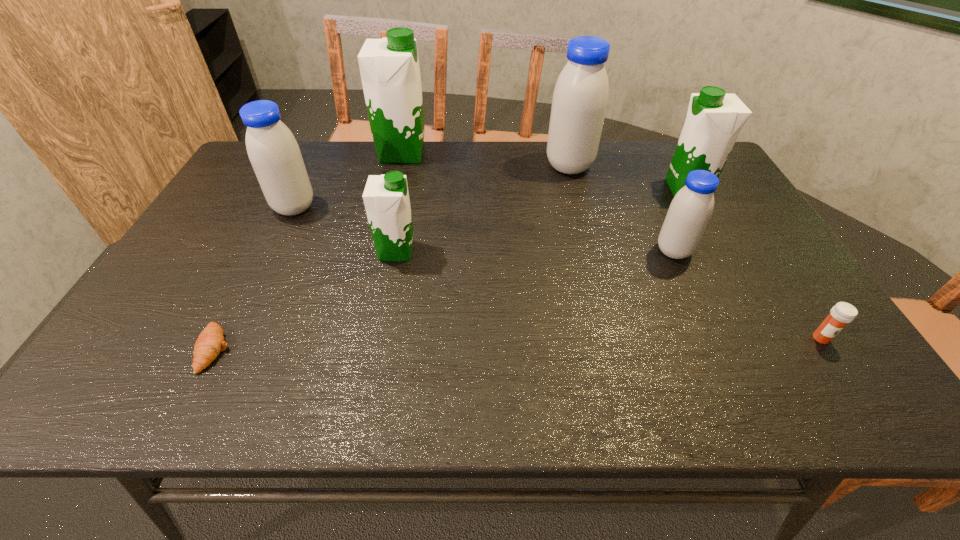
Locate an element on the screen. Image resolution: width=960 pixels, height=540 pixels. free space that satisfies the following two spatial constraints: 1. on the back side of the farthest blue soya milk; 2. on the front-facing side of the biggest green soya milk is located at coordinates (566, 153).

At what (x,y) coordinates should I click in order to perform the action: click on vacant point that satisfies the following two spatial constraints: 1. on the front-facing side of the biggest green soya milk; 2. on the back side of the farthest blue soya milk. Please return your answer as a coordinate pair (x, y). The width and height of the screenshot is (960, 540). Looking at the image, I should click on (398, 166).

The width and height of the screenshot is (960, 540). Find the location of `free point that satisfies the following two spatial constraints: 1. on the front side of the second blue soya milk from left to right; 2. on the front-facing side of the smallest green soya milk`. free point that satisfies the following two spatial constraints: 1. on the front side of the second blue soya milk from left to right; 2. on the front-facing side of the smallest green soya milk is located at coordinates (591, 251).

Locate an element on the screen. Image resolution: width=960 pixels, height=540 pixels. vacant region that satisfies the following two spatial constraints: 1. on the back side of the sixth object from left to right; 2. on the front-facing side of the biggest green soya milk is located at coordinates (630, 153).

Locate an element on the screen. The image size is (960, 540). vacant space that satisfies the following two spatial constraints: 1. on the front-facing side of the biggest green soya milk; 2. on the left side of the third soya milk from right to left is located at coordinates (398, 166).

You are a GUI agent. You are given a task and a screenshot of the screen. Output one action in this format:
    pyautogui.click(x=<x>, y=<y>)
    Task: Click on the vacant space that satisfies the following two spatial constraints: 1. on the back side of the second soya milk from right to left; 2. on the front-facing side of the farthest green soya milk
    
    Given the screenshot: What is the action you would take?
    pyautogui.click(x=630, y=153)

Image resolution: width=960 pixels, height=540 pixels. What are the coordinates of `vacant space that satisfies the following two spatial constraints: 1. on the front side of the farthest blue soya milk; 2. on the right side of the third object from right to left` in the screenshot? It's located at (591, 251).